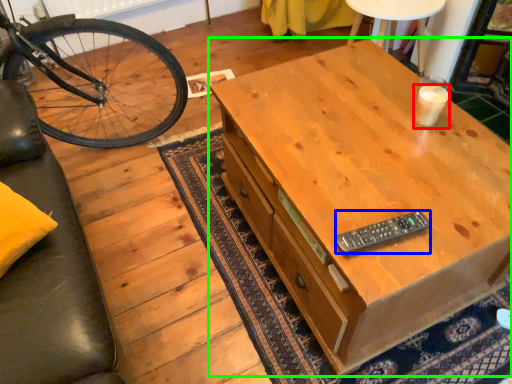
Question: Which object is the farthest from coffee cup (highlighted by a red box)? Choose among these: remote control (highlighted by a blue box) or desk (highlighted by a green box).

Choices:
 (A) remote control
 (B) desk

Answer: (A)